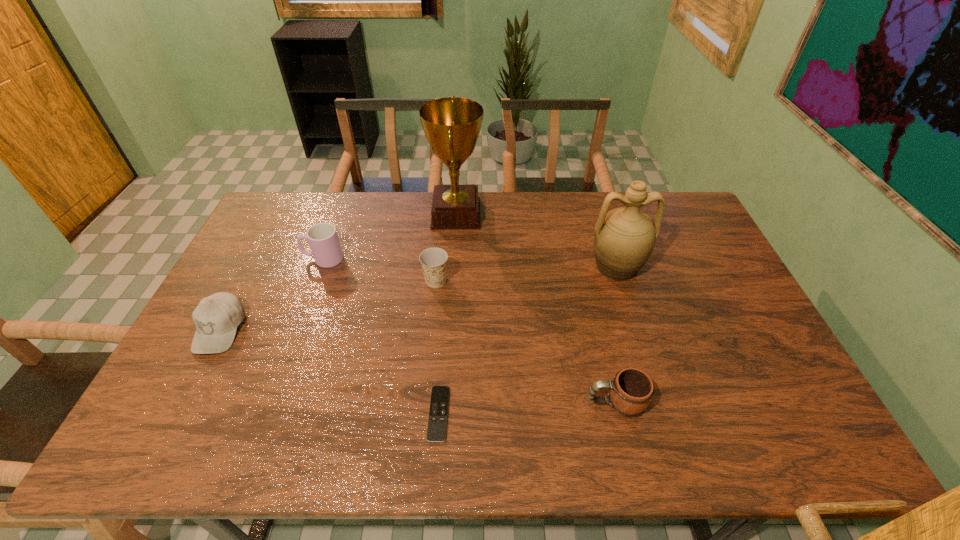
Where is `the tallest object`? This screenshot has width=960, height=540. the tallest object is located at coordinates (451, 125).

Where is `the farthest object`? the farthest object is located at coordinates (451, 125).

Locate an element on the screen. the second tallest object is located at coordinates click(x=624, y=238).

Where is `the second object from left to right`? Image resolution: width=960 pixels, height=540 pixels. the second object from left to right is located at coordinates (323, 239).

I want to click on Dixie cup, so pos(433,260).

The height and width of the screenshot is (540, 960). I want to click on the leftmost object, so click(x=216, y=318).

Locate an element on the screen. The height and width of the screenshot is (540, 960). baseball cap is located at coordinates (216, 318).

This screenshot has height=540, width=960. I want to click on mug, so click(631, 390).

You are a GUI agent. You are given a task and a screenshot of the screen. Output one action in this format:
    pyautogui.click(x=<x>, y=<y>)
    Task: Click on the remote control
    Image resolution: width=960 pixels, height=540 pixels.
    Given the screenshot: What is the action you would take?
    pyautogui.click(x=437, y=424)

At what (x,y) coordinates should I click in order to perform the action: click on vacant area situated 0.060m on the plaque of the farthest object. Please return your answer as a coordinate pair (x, y). The height and width of the screenshot is (540, 960). Looking at the image, I should click on (499, 214).